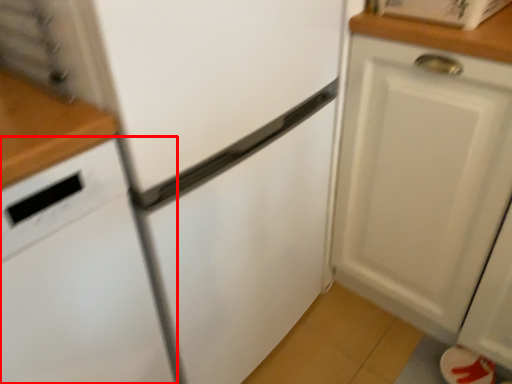
Question: From the image's perspective, where is dish washer (annotated by the red box) located in relation to cabinetry in the image?

Choices:
 (A) above
 (B) below

Answer: (B)